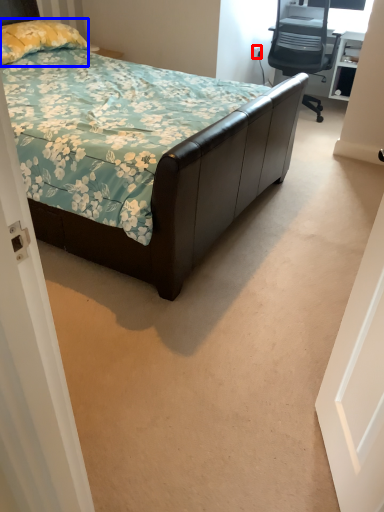
Question: Which object is further to the camera taking this photo, power outlet (highlighted by a red box) or pillow (highlighted by a blue box)?

Choices:
 (A) power outlet
 (B) pillow

Answer: (A)